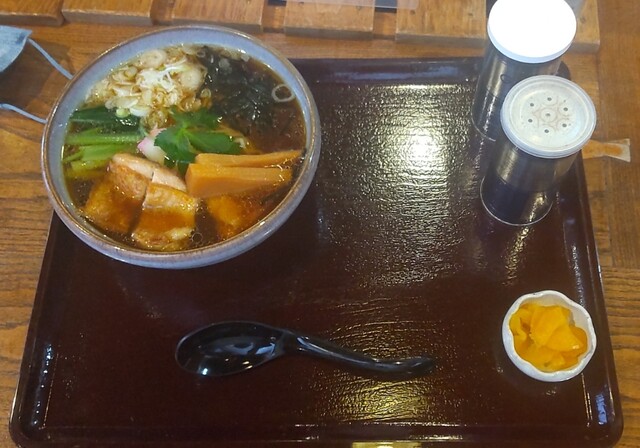
This screenshot has width=640, height=448. Identify the location of brown tray. 420,239.